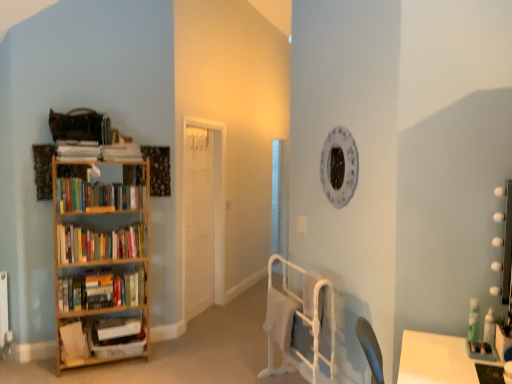
Question: Is wooden bookshelf at left bigger or smaller than white metal bed frame at lower center?

Choices:
 (A) small
 (B) big

Answer: (B)

Question: Is wooden bookshelf at left situated inside white metal bed frame at lower center or outside?

Choices:
 (A) outside
 (B) inside

Answer: (A)

Question: Estimate the real-world distances between objects in this image. Which object is farther from the white matte bookshelf at left, marked as the fourth book in a top-to-bottom arrangement?

Choices:
 (A) white matte door at center
 (B) white plastic crate at lower left, arranged as the fifth book when viewed from the top
 (C) wooden bookshelf at left, the third book ordered from the bottom
 (D) wooden bookshelf at left
 (E) hardcover books at left, which is counted as the 5th book, starting from the bottom

Answer: (A)

Question: Which of these objects is positioned farthest from the white metal bed frame at lower center?

Choices:
 (A) wooden bookshelf at left, the third book viewed from the top
 (B) wooden bookshelf at left
 (C) white matte bookshelf at left, which ranks as the 2th book in bottom-to-top order
 (D) white plastic crate at lower left, arranged as the fifth book when viewed from the top
 (E) hardcover books at left, which is counted as the 5th book, starting from the bottom

Answer: (C)